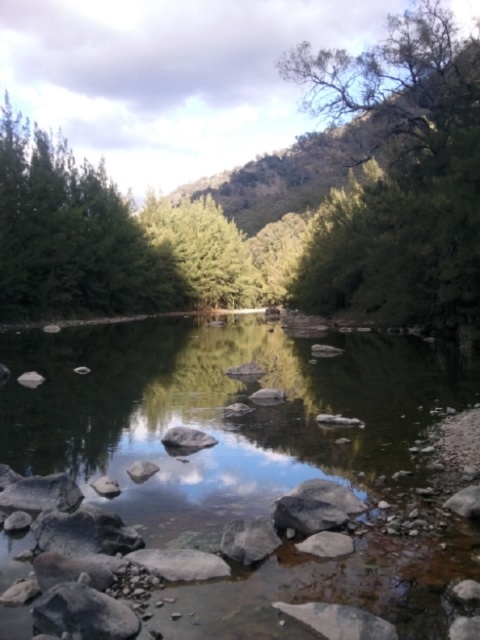
You are standing at the edge of the river and notice a point marked at coordinates [222,413]. What feature does this point correspond to in the scene?

The point at coordinates [222,413] corresponds to the smooth rock stream at center.

Looking at this image, you are standing at the point marked as point (400, 176) in the image. Looking around, you see a green leafy tree at upper right. Which direction should you face to see the green leafy tree at upper right?

You should face towards the upper right direction to see the green leafy tree at upper right since the point (400, 176) is located at the upper right of the image.